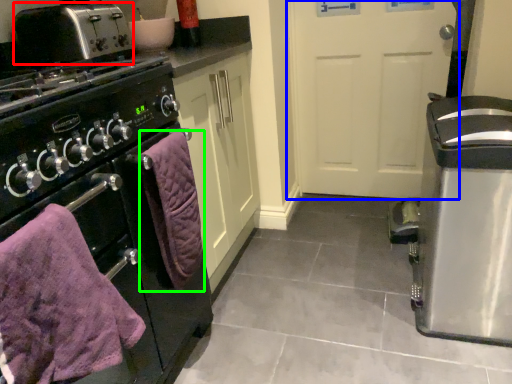
Question: Which object is positioned closest to toaster (highlighted by a red box)? Select from door (highlighted by a blue box) and bath towel (highlighted by a green box).

Choices:
 (A) door
 (B) bath towel

Answer: (B)